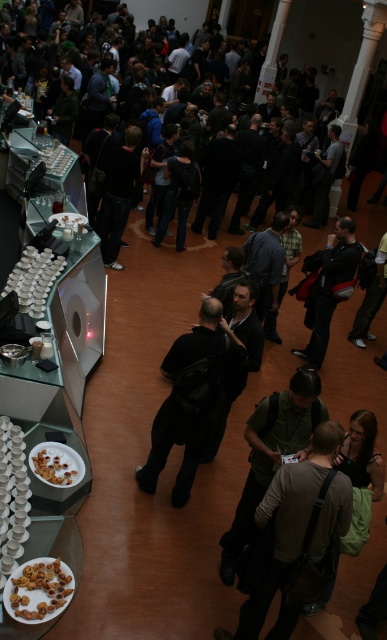
You are organizing a small event and need to place a decorative plant between the dark gray backpack at center and the brown matte nuts at lower left. Which object should the plant be placed closer to, considering their heights?

The plant should be placed closer to the brown matte nuts at lower left because the dark gray backpack at center is much taller, so positioning the plant near the shorter object would create a balanced arrangement.

You are at a conference and need to grab a snack. You see a dark gray backpack at center and brown matte nuts at lower left. Which item is closer to your current position if you are standing to the left of both objects?

The brown matte nuts at lower left are closer because the dark gray backpack at center is positioned to the right of them, so from your left position, the nuts are nearer.